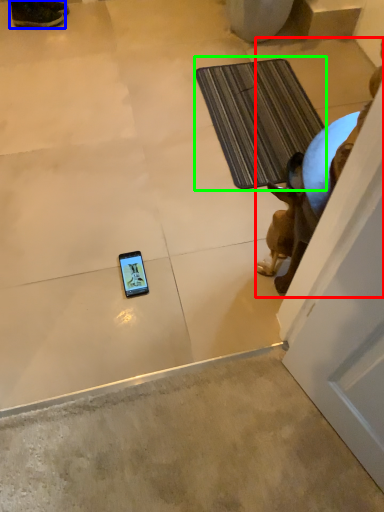
Question: Based on their relative distances, which object is nearer to animal (highlighted by a red box)? Choose from footwear (highlighted by a blue box) and bath mat (highlighted by a green box).

Choices:
 (A) footwear
 (B) bath mat

Answer: (B)